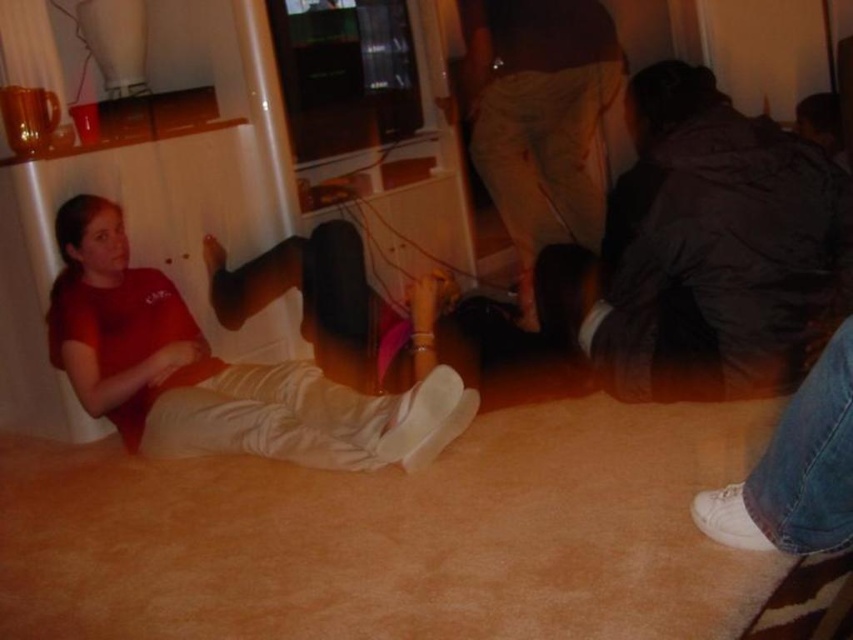
You are organizing a small storage area in the living room and need to stack the dark brown jacket at lower right and the light brown cotton pants at center vertically. Which item should you place at the bottom of the stack to ensure stability?

The dark brown jacket at lower right has a lesser height compared to light brown cotton pants at center, so placing the jacket at the bottom would provide a stable base for the pants on top.

You are trying to place a small pillow on the floor near the dark brown jacket at lower right. Based on the coordinates provided, where should you place the pillow to ensure it is directly next to the jacket?

The dark brown jacket at lower right is located at point (705, 252). To place the pillow directly next to it, position it near those coordinates.